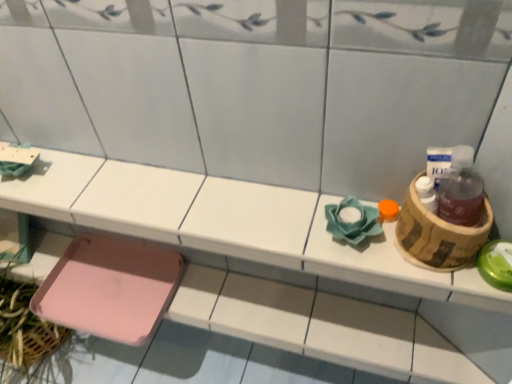
At what (x,y) coordinates should I click in order to perform the action: click on blank space situated above pink plastic tray at lower left (from a real-world perspective). Please return your answer as a coordinate pair (x, y). Looking at the image, I should click on (197, 204).